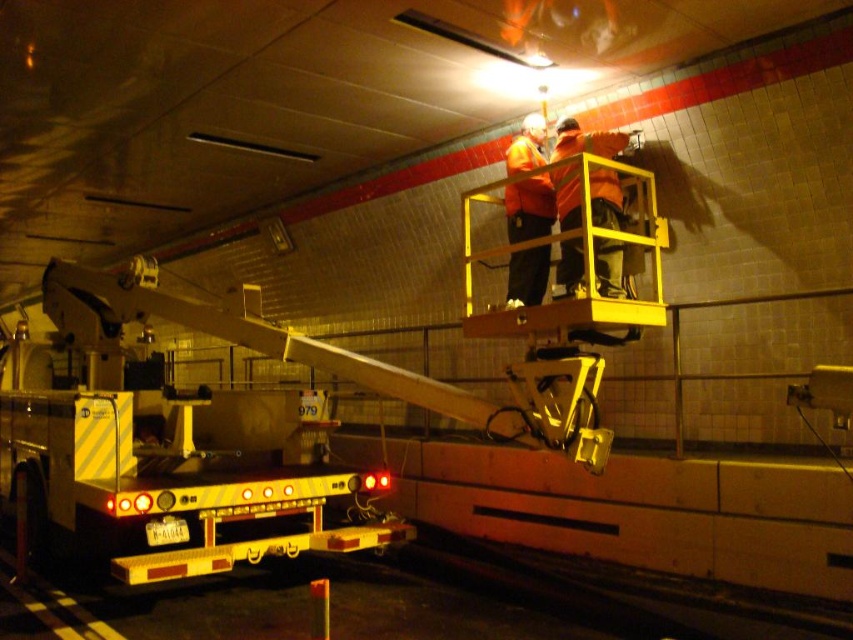
Question: Does orange reflective safety vest at center lie in front of orange reflective jacket at center?

Choices:
 (A) no
 (B) yes

Answer: (B)

Question: Which point is farther to the camera?

Choices:
 (A) orange reflective safety vest at center
 (B) orange reflective jacket at center

Answer: (B)

Question: Is orange reflective safety vest at center smaller than orange reflective jacket at center?

Choices:
 (A) yes
 (B) no

Answer: (A)

Question: Among these points, which one is nearest to the camera?

Choices:
 (A) pyautogui.click(x=614, y=195)
 (B) pyautogui.click(x=538, y=275)

Answer: (A)

Question: Does orange reflective safety vest at center have a greater width compared to orange reflective jacket at center?

Choices:
 (A) yes
 (B) no

Answer: (A)